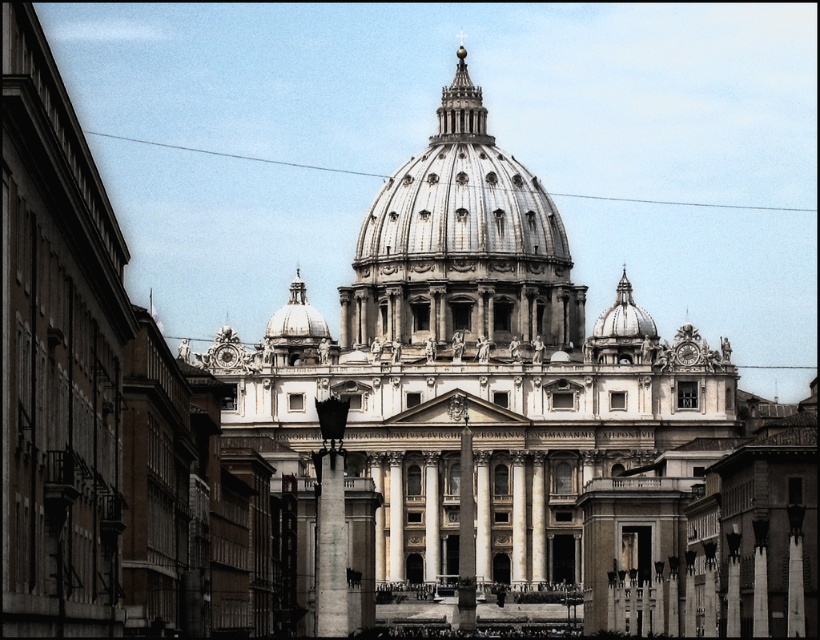
Find the location of `polished stone column at center`. polished stone column at center is located at coordinates (467, 534).

This screenshot has width=820, height=640. What do you see at coordinates (467, 534) in the screenshot? I see `polished stone column at center` at bounding box center [467, 534].

This screenshot has height=640, width=820. Find the location of `polished stone column at center`. polished stone column at center is located at coordinates (467, 534).

Where is `white marble church at center`? The width and height of the screenshot is (820, 640). white marble church at center is located at coordinates (470, 365).

Which of these two, white marble church at center or shiny silver dome at center, stands taller?

Standing taller between the two is white marble church at center.

Does point (413, 216) lie in front of point (358, 250)?

Yes.

At what (x,y) coordinates should I click in order to perform the action: click on white marble church at center. Please return your answer as a coordinate pair (x, y). Looking at the image, I should click on (470, 365).

Does smooth stone pillar at center appear on the right side of polished stone column at center?

In fact, smooth stone pillar at center is to the left of polished stone column at center.

From the picture: Is smooth stone pillar at center shorter than polished stone column at center?

Yes.

You are a GUI agent. You are given a task and a screenshot of the screen. Output one action in this format:
    pyautogui.click(x=<x>, y=<y>)
    Task: Click on the smooth stone pillar at center
    
    Given the screenshot: What is the action you would take?
    pyautogui.click(x=331, y=547)

The image size is (820, 640). Identify the location of smooth stone pillar at center. (331, 547).